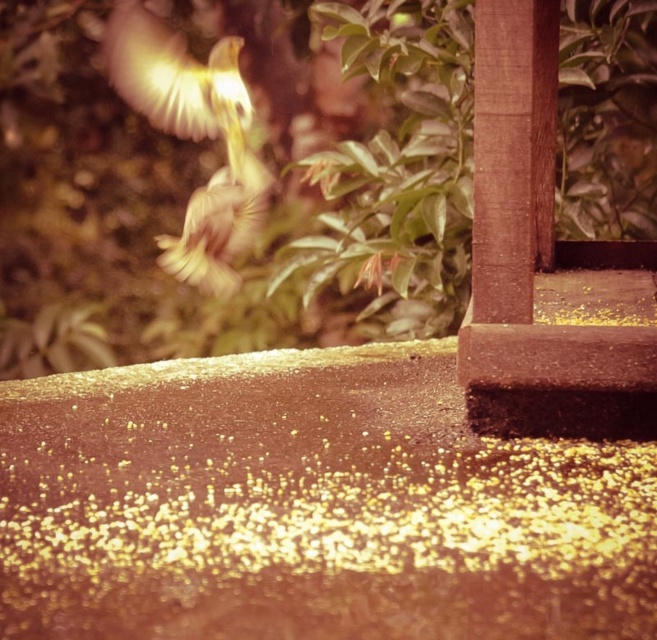
Is translucent yellow bird at upper left closer to the viewer compared to light brown feathers at center?

Yes, translucent yellow bird at upper left is closer to the viewer.

Is translucent yellow bird at upper left smaller than light brown feathers at center?

No.

This screenshot has width=657, height=640. I want to click on translucent yellow bird at upper left, so click(x=183, y=84).